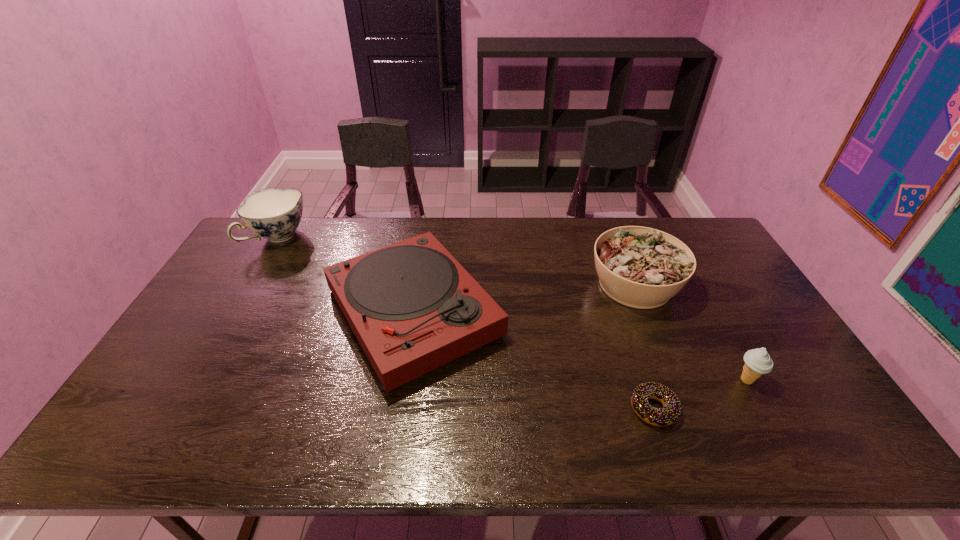
Where is `the leftmost object`? the leftmost object is located at coordinates (274, 214).

Where is `salad`? The image size is (960, 540). salad is located at coordinates (640, 267).

You are a GUI agent. You are given a task and a screenshot of the screen. Output one action in this format:
    pyautogui.click(x=<x>, y=<y>)
    Task: Click on the record player
    
    Given the screenshot: What is the action you would take?
    pyautogui.click(x=411, y=305)

Identify the location of the rightmost object. (757, 361).

This screenshot has width=960, height=540. Find the location of `the shortest object`. the shortest object is located at coordinates (670, 412).

This screenshot has width=960, height=540. I want to click on vacant region located 0.360m on the right of the chinaware, so coord(407,238).

The height and width of the screenshot is (540, 960). In order to click on free space located on the front of the salad in this screenshot , I will do `click(695, 437)`.

Identify the location of blank space located 0.100m on the back of the fourth object from right to left. (425, 237).

The width and height of the screenshot is (960, 540). I want to click on vacant position located on the back of the icecream, so click(x=694, y=284).

Where is `vacant region located 0.180m on the left of the doughnut`? The image size is (960, 540). vacant region located 0.180m on the left of the doughnut is located at coordinates (557, 409).